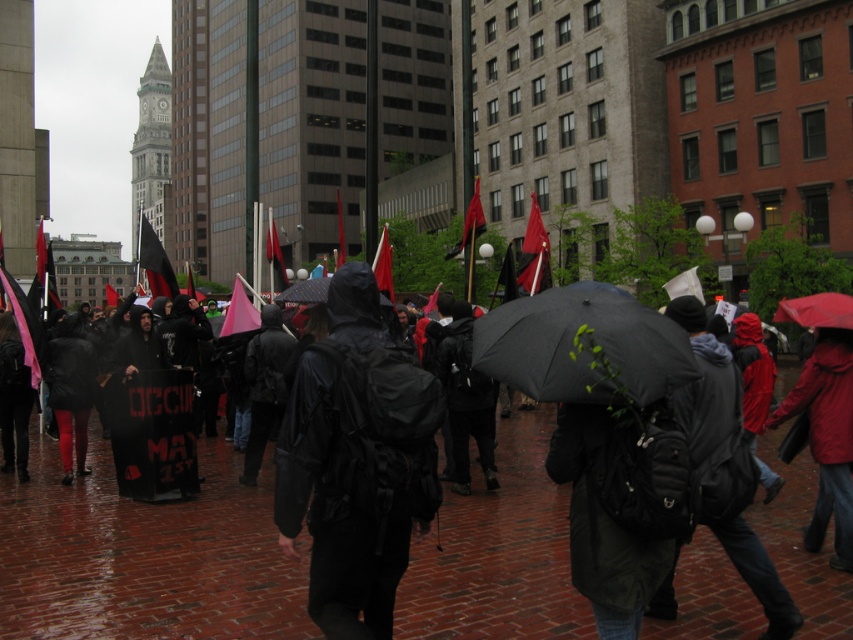
Question: Does black matte jacket at center have a greater width compared to black matte umbrella at center?

Choices:
 (A) no
 (B) yes

Answer: (A)

Question: Considering the relative positions of black matte jacket at center and red fabric flag at upper center in the image provided, where is black matte jacket at center located with respect to red fabric flag at upper center?

Choices:
 (A) left
 (B) right

Answer: (A)

Question: Which point is farther to the camera?

Choices:
 (A) (519, 275)
 (B) (621, 320)

Answer: (A)

Question: Among these points, which one is farthest from the camera?

Choices:
 (A) (334, 300)
 (B) (779, 314)

Answer: (B)

Question: Does brick pavement at center have a greater width compared to black matte umbrella at center?

Choices:
 (A) no
 (B) yes

Answer: (B)

Question: Considering the real-world distances, which object is closest to the black matte jacket at center?

Choices:
 (A) red matte umbrella at right
 (B) black matte umbrella at center
 (C) brick pavement at center
 (D) red fabric flag at upper center

Answer: (B)